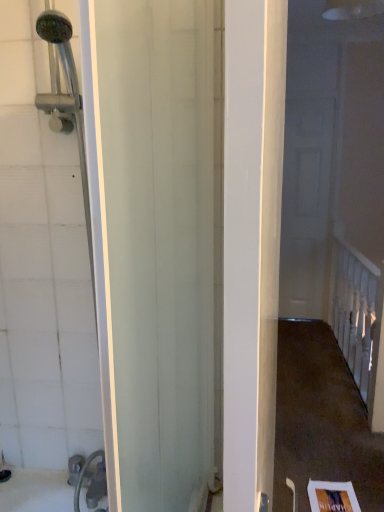
This screenshot has width=384, height=512. I want to click on white painted wood railing at upper right, so click(357, 313).

Describe the element at coordinates (357, 313) in the screenshot. I see `white painted wood railing at upper right` at that location.

Locate an element on the screen. white glossy door at right is located at coordinates (306, 207).

Describe the element at coordinates (306, 207) in the screenshot. The width and height of the screenshot is (384, 512). I see `white glossy door at right` at that location.

Identify the location of white painted wood railing at upper right. (357, 313).

Is white glossy door at right to the left or to the right of white painted wood railing at upper right in the image?

Based on their positions, white glossy door at right is located to the left of white painted wood railing at upper right.

In the scene shown: Who is more distant, white glossy door at right or white painted wood railing at upper right?

white glossy door at right.

Considering the points (298, 157) and (334, 298), which point is in front, point (298, 157) or point (334, 298)?

Positioned in front is point (334, 298).

From the image's perspective, which one is positioned higher, white glossy door at right or white painted wood railing at upper right?

white glossy door at right is shown above in the image.

From a real-world perspective, between white glossy door at right and white painted wood railing at upper right, who is vertically lower?

From a 3D spatial view, white painted wood railing at upper right is below.

Looking at this image, which object is wider, white glossy door at right or white painted wood railing at upper right?

white painted wood railing at upper right.

Does white glossy door at right have a lesser height compared to white painted wood railing at upper right?

In fact, white glossy door at right may be taller than white painted wood railing at upper right.

Considering the relative sizes of white glossy door at right and white painted wood railing at upper right in the image provided, is white glossy door at right bigger than white painted wood railing at upper right?

Actually, white glossy door at right might be smaller than white painted wood railing at upper right.

Which is correct: white glossy door at right is inside white painted wood railing at upper right, or outside of it?

white glossy door at right exists outside the volume of white painted wood railing at upper right.

Is white glossy door at right placed right next to white painted wood railing at upper right?

white glossy door at right is not next to white painted wood railing at upper right, and they're not touching.

In the scene shown: Could you tell me if white glossy door at right is turned towards white painted wood railing at upper right?

Yes, white glossy door at right faces towards white painted wood railing at upper right.

Can you tell me how much white glossy door at right and white painted wood railing at upper right differ in facing direction?

90 degrees separate the facing orientations of white glossy door at right and white painted wood railing at upper right.

Find the location of a particular element. This screenshot has width=384, height=512. screen door behind the white painted wood railing at upper right is located at coordinates (306, 207).

Between white painted wood railing at upper right and white glossy door at right, which one appears on the right side from the viewer's perspective?

white painted wood railing at upper right is more to the right.

Is white painted wood railing at upper right behind white glossy door at right?

No, it is not.

Is point (378, 270) farther from camera compared to point (291, 290)?

No, it is not.

From the image's perspective, which is below, white painted wood railing at upper right or white glossy door at right?

white painted wood railing at upper right.

From a real-world perspective, is white painted wood railing at upper right physically located above or below white glossy door at right?

Clearly, from a real-world perspective, white painted wood railing at upper right is below white glossy door at right.

Between white painted wood railing at upper right and white glossy door at right, which one has smaller width?

white glossy door at right is thinner.

In terms of height, does white painted wood railing at upper right look taller or shorter compared to white glossy door at right?

white painted wood railing at upper right is shorter than white glossy door at right.

Considering the relative sizes of white painted wood railing at upper right and white glossy door at right in the image provided, is white painted wood railing at upper right bigger than white glossy door at right?

Yes, white painted wood railing at upper right is bigger than white glossy door at right.

Is white painted wood railing at upper right not inside white glossy door at right?

Yes, white painted wood railing at upper right is outside of white glossy door at right.

Are white painted wood railing at upper right and white glossy door at right beside each other?

No, white painted wood railing at upper right is not in contact with white glossy door at right.

Is white painted wood railing at upper right facing towards white glossy door at right?

No, white painted wood railing at upper right is not turned towards white glossy door at right.

At what (x,y) coordinates should I click in order to perform the action: click on rail in front of the white glossy door at right. Please return your answer as a coordinate pair (x, y). Looking at the image, I should click on (357, 313).

The width and height of the screenshot is (384, 512). What are the coordinates of `rail on the right of white glossy door at right` in the screenshot? It's located at (357, 313).

What are the coordinates of `rail in front of the white glossy door at right` in the screenshot? It's located at (357, 313).